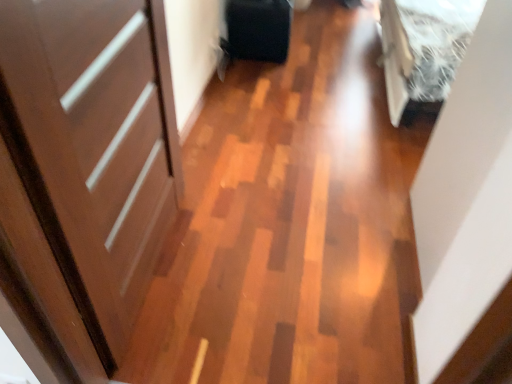
Describe the element at coordinates (423, 51) in the screenshot. The width and height of the screenshot is (512, 384). I see `white fluffy bed at upper right` at that location.

This screenshot has width=512, height=384. What are the coordinates of `white fluffy bed at upper right` in the screenshot? It's located at (423, 51).

Which is more to the right, matte black suitcase at center or white fluffy bed at upper right?

white fluffy bed at upper right is more to the right.

Locate an element on the screen. bed lying in front of the matte black suitcase at center is located at coordinates (423, 51).

Can white fluffy bed at upper right be found inside matte black suitcase at center?

No, white fluffy bed at upper right is not a part of matte black suitcase at center.

Based on the photo, from the image's perspective, is matte black suitcase at center on top of white fluffy bed at upper right?

Yes, from the image's perspective, matte black suitcase at center is above white fluffy bed at upper right.

Is point (79, 241) positioned behind point (405, 72)?

No.

How many degrees apart are the facing directions of matte brown door at left and white fluffy bed at upper right?

There is a 176-degree angle between the facing directions of matte brown door at left and white fluffy bed at upper right.

From the image's perspective, is matte brown door at left above or below white fluffy bed at upper right?

From the image's perspective, matte brown door at left appears below white fluffy bed at upper right.

Does white fluffy bed at upper right have a greater height compared to matte brown door at left?

Incorrect, the height of white fluffy bed at upper right is not larger of that of matte brown door at left.

From the image's perspective, relative to matte brown door at left, is white fluffy bed at upper right above or below?

white fluffy bed at upper right is situated higher than matte brown door at left in the image.

Is white fluffy bed at upper right oriented towards matte brown door at left?

No, white fluffy bed at upper right is not facing towards matte brown door at left.

Considering the positions of objects matte brown door at left and matte black suitcase at center in the image provided, who is more to the right, matte brown door at left or matte black suitcase at center?

From the viewer's perspective, matte black suitcase at center appears more on the right side.

From the image's perspective, which object appears higher, matte brown door at left or matte black suitcase at center?

matte black suitcase at center, from the image's perspective.

From a real-world perspective, is matte brown door at left positioned over matte black suitcase at center based on gravity?

Yes.

Is white fluffy bed at upper right looking in the opposite direction of matte black suitcase at center?

No, white fluffy bed at upper right is not facing away from matte black suitcase at center.

Does white fluffy bed at upper right come in front of matte black suitcase at center?

Yes, white fluffy bed at upper right is closer to the camera.

From the image's perspective, is white fluffy bed at upper right over matte black suitcase at center?

No.

Is matte black suitcase at center completely or partially inside white fluffy bed at upper right?

No, matte black suitcase at center is not surrounded by white fluffy bed at upper right.

How much distance is there between matte black suitcase at center and matte brown door at left?

A distance of 5.61 feet exists between matte black suitcase at center and matte brown door at left.

Is matte black suitcase at center positioned with its back to matte brown door at left?

Answer: No, matte black suitcase at center's orientation is not away from matte brown door at left.

Which of these two, matte black suitcase at center or matte brown door at left, is bigger?

Bigger between the two is matte brown door at left.

Considering the positions of objects matte black suitcase at center and matte brown door at left in the image provided, who is more to the left, matte black suitcase at center or matte brown door at left?

matte brown door at left.

Where is `luggage on the left of white fluffy bed at upper right`? This screenshot has height=384, width=512. luggage on the left of white fluffy bed at upper right is located at coordinates (258, 29).

In order to click on bed on the right of matte brown door at left in this screenshot , I will do `click(423, 51)`.

Looking at the image, which one is located further to white fluffy bed at upper right, matte brown door at left or matte black suitcase at center?

Among the two, matte brown door at left is located further to white fluffy bed at upper right.

From the image, which object appears to be nearer to matte black suitcase at center, white fluffy bed at upper right or matte brown door at left?

Based on the image, white fluffy bed at upper right appears to be nearer to matte black suitcase at center.

Considering their positions, is white fluffy bed at upper right positioned closer to matte brown door at left than matte black suitcase at center?

white fluffy bed at upper right is closer to matte brown door at left.

Estimate the real-world distances between objects in this image. Which object is further from white fluffy bed at upper right, matte black suitcase at center or matte brown door at left?

matte brown door at left is further to white fluffy bed at upper right.

Which object lies nearer to the anchor point matte brown door at left, matte black suitcase at center or white fluffy bed at upper right?

The object closer to matte brown door at left is white fluffy bed at upper right.

Which object lies nearer to the anchor point matte black suitcase at center, matte brown door at left or white fluffy bed at upper right?

white fluffy bed at upper right lies closer to matte black suitcase at center than the other object.

Identify the location of bed between matte brown door at left and matte black suitcase at center from front to back. This screenshot has width=512, height=384. (423, 51).